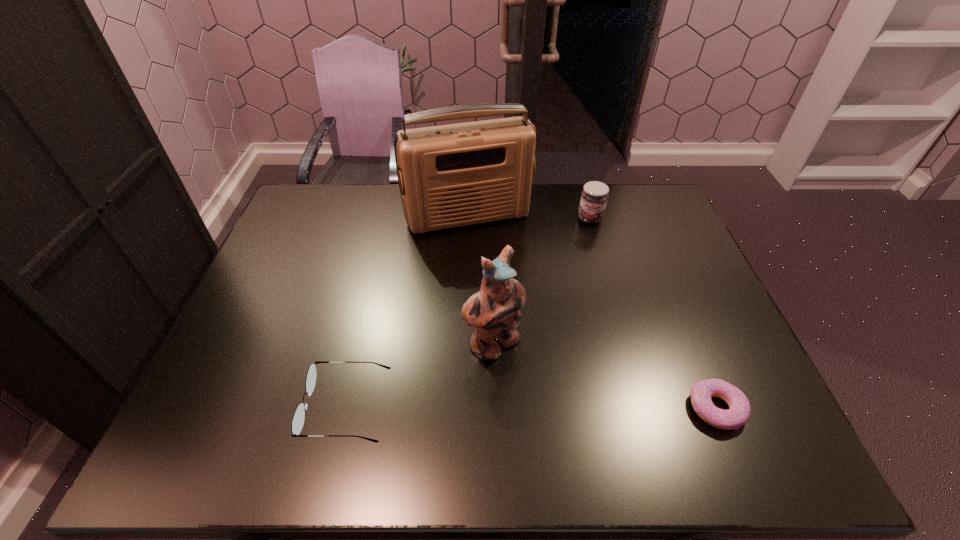
Locate an element on the screen. free space at the right edge of the desktop is located at coordinates (673, 276).

Find the location of a particular element. free space at the far left corner of the desktop is located at coordinates (309, 213).

Where is `vacant space at the far right corner of the desktop`? This screenshot has height=540, width=960. vacant space at the far right corner of the desktop is located at coordinates (654, 210).

What are the coordinates of `vacant space that's between the radio receiver and the third tallest object` in the screenshot? It's located at (529, 218).

In order to click on vacant area that lies between the figurine and the spectacles in this screenshot , I will do `click(420, 376)`.

Locate an element on the screen. The width and height of the screenshot is (960, 540). vacant area that lies between the radio receiver and the third nearest object is located at coordinates (481, 281).

Where is `free spot between the third nearest object and the radio receiver`? This screenshot has height=540, width=960. free spot between the third nearest object and the radio receiver is located at coordinates (481, 281).

What are the coordinates of `free space between the tallest object and the second shortest object` in the screenshot? It's located at (408, 312).

The width and height of the screenshot is (960, 540). I want to click on vacant area between the tallest object and the fourth tallest object, so click(x=408, y=312).

Locate an element on the screen. vacant area that lies between the radio receiver and the figurine is located at coordinates pos(481,281).